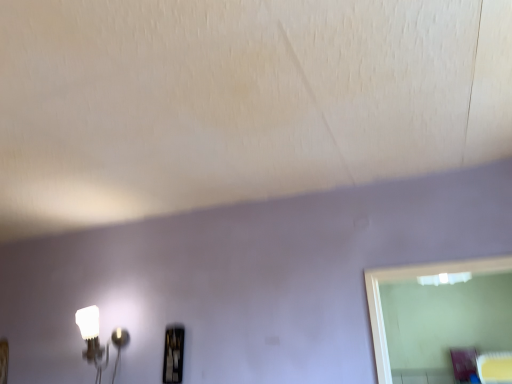
Find the location of a particular element. This screenshot has width=512, height=384. white glossy wall sconce at lower left is located at coordinates (92, 339).

The width and height of the screenshot is (512, 384). Describe the element at coordinates (92, 339) in the screenshot. I see `white glossy wall sconce at lower left` at that location.

Measure the distance between white glossy wall sconce at lower left and camera.

white glossy wall sconce at lower left is 2.23 meters from camera.

The height and width of the screenshot is (384, 512). What are the coordinates of `white glossy wall sconce at lower left` in the screenshot? It's located at (92, 339).